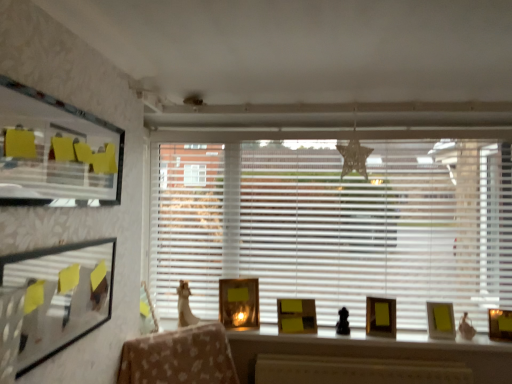
At what (x,y) coordinates should I click in order to perform the action: click on vacant area in front of matte gold picture frame at right, placed as the third picture frame when sorted from back to front. Please return your answer as a coordinate pair (x, y). Looking at the image, I should click on (449, 340).